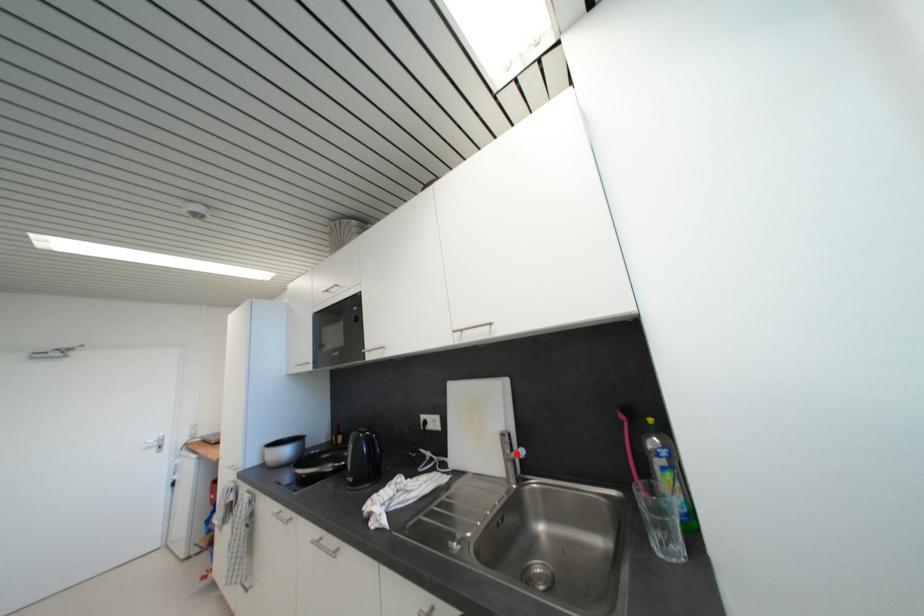
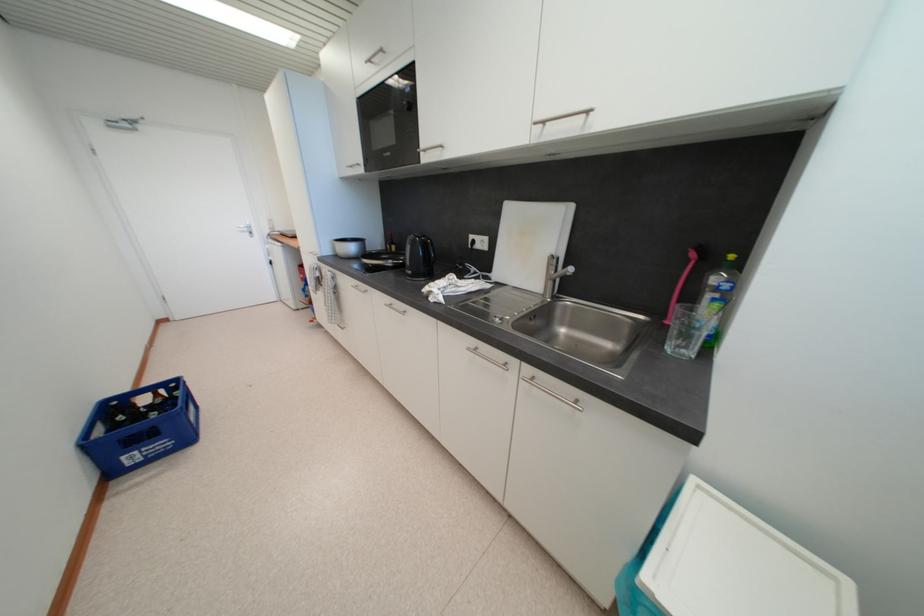
In the second image, find the point that corresponds to the highlighted location in the first image.

(561, 275)